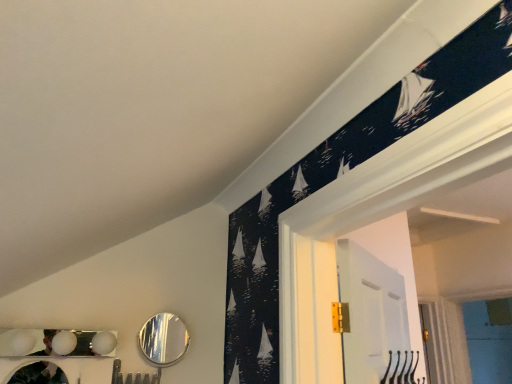
Question: Is the position of shiny silver mirror at lower center, the second mirror in the left-to-right sequence, more distant than that of metallic silver mirror at lower left, marked as the 2th mirror in a right-to-left arrangement?

Choices:
 (A) no
 (B) yes

Answer: (B)

Question: Considering the relative sizes of shiny silver mirror at lower center, positioned as the 1th mirror in back-to-front order, and metallic silver mirror at lower left, which appears as the 1th mirror when viewed from the left, in the image provided, is shiny silver mirror at lower center, positioned as the 1th mirror in back-to-front order, smaller than metallic silver mirror at lower left, which appears as the 1th mirror when viewed from the left,?

Choices:
 (A) no
 (B) yes

Answer: (A)

Question: Considering the relative sizes of shiny silver mirror at lower center, positioned as the 1th mirror in back-to-front order, and metallic silver mirror at lower left, marked as the 2th mirror in a right-to-left arrangement, in the image provided, is shiny silver mirror at lower center, positioned as the 1th mirror in back-to-front order, shorter than metallic silver mirror at lower left, marked as the 2th mirror in a right-to-left arrangement,?

Choices:
 (A) no
 (B) yes

Answer: (A)

Question: Does shiny silver mirror at lower center, positioned as the 1th mirror in back-to-front order, have a greater height compared to metallic silver mirror at lower left, which is the second mirror from back to front?

Choices:
 (A) no
 (B) yes

Answer: (B)

Question: Considering the relative sizes of shiny silver mirror at lower center, arranged as the first mirror when viewed from the right, and metallic silver mirror at lower left, which appears as the 1th mirror when viewed from the left, in the image provided, is shiny silver mirror at lower center, arranged as the first mirror when viewed from the right, thinner than metallic silver mirror at lower left, which appears as the 1th mirror when viewed from the left,?

Choices:
 (A) yes
 (B) no

Answer: (A)

Question: Would you say shiny silver mirror at lower center, the second mirror in the left-to-right sequence, is a long distance from metallic silver mirror at lower left, acting as the 1th mirror starting from the front?

Choices:
 (A) yes
 (B) no

Answer: (B)

Question: Is metallic silver mirror at lower left, which appears as the 1th mirror when viewed from the left, positioned far away from shiny silver mirror at lower center, arranged as the second mirror when viewed from the front?

Choices:
 (A) yes
 (B) no

Answer: (B)

Question: From a real-world perspective, is metallic silver mirror at lower left, acting as the 1th mirror starting from the front, located beneath shiny silver mirror at lower center, positioned as the 1th mirror in back-to-front order?

Choices:
 (A) no
 (B) yes

Answer: (B)

Question: Considering the relative sizes of metallic silver mirror at lower left, which appears as the 1th mirror when viewed from the left, and shiny silver mirror at lower center, positioned as the 1th mirror in back-to-front order, in the image provided, is metallic silver mirror at lower left, which appears as the 1th mirror when viewed from the left, bigger than shiny silver mirror at lower center, positioned as the 1th mirror in back-to-front order,?

Choices:
 (A) no
 (B) yes

Answer: (A)

Question: Is metallic silver mirror at lower left, which appears as the 1th mirror when viewed from the left, facing away from shiny silver mirror at lower center, the second mirror in the left-to-right sequence?

Choices:
 (A) yes
 (B) no

Answer: (B)

Question: Does metallic silver mirror at lower left, acting as the 1th mirror starting from the front, have a smaller size compared to shiny silver mirror at lower center, arranged as the second mirror when viewed from the front?

Choices:
 (A) no
 (B) yes

Answer: (B)

Question: Considering the relative sizes of metallic silver mirror at lower left, which is the second mirror from back to front, and shiny silver mirror at lower center, arranged as the second mirror when viewed from the front, in the image provided, is metallic silver mirror at lower left, which is the second mirror from back to front, shorter than shiny silver mirror at lower center, arranged as the second mirror when viewed from the front,?

Choices:
 (A) yes
 (B) no

Answer: (A)

Question: Is metallic silver mirror at lower left, acting as the 1th mirror starting from the front, taller or shorter than shiny silver mirror at lower center, arranged as the first mirror when viewed from the right?

Choices:
 (A) short
 (B) tall

Answer: (A)